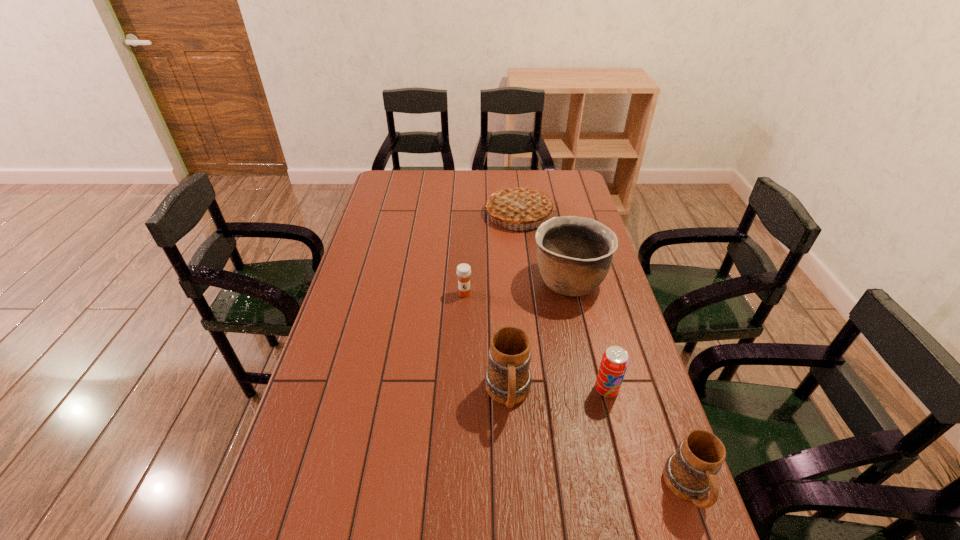
I want to click on vacant area that lies between the soda can and the left mug, so click(558, 392).

Image resolution: width=960 pixels, height=540 pixels. Identify the location of vacant region between the medicine and the pie. pos(492,254).

Locate an element on the screen. free space between the pottery and the farther mug is located at coordinates (539, 338).

Where is `vacant space in between the pottery and the right mug`? The image size is (960, 540). vacant space in between the pottery and the right mug is located at coordinates (628, 385).

Identify the location of blank region between the soda can and the shortest object. (536, 341).

Select which object is the fourth closest to the soda can. Please provide its 2D coordinates. Your answer should be formatted as a tuple, i.e. [(x, y)], where the tuple contains the x and y coordinates of a point satisfying the conditions above.

[(463, 271)]

The width and height of the screenshot is (960, 540). Find the location of `object that can be found as the fifth closest to the pottery`. object that can be found as the fifth closest to the pottery is located at coordinates [689, 473].